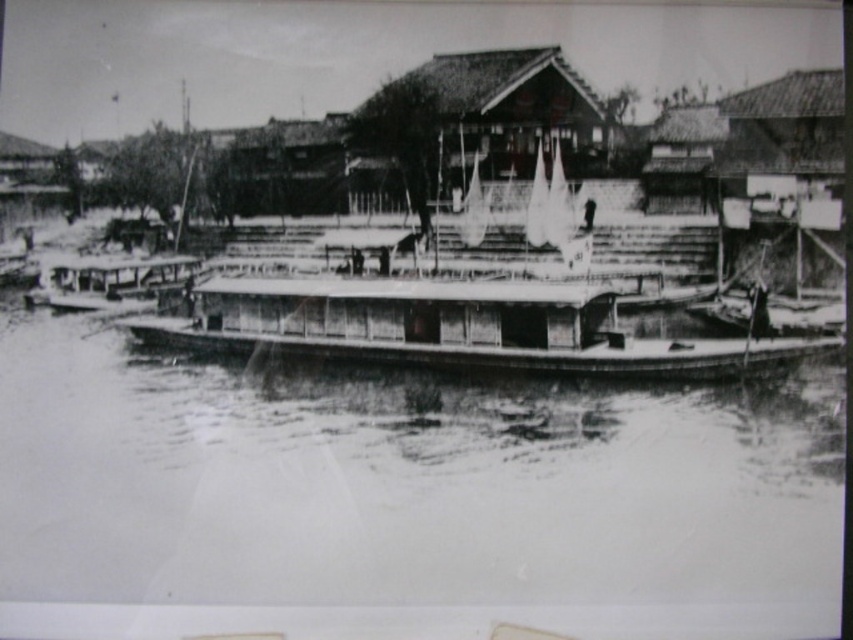
Does smooth wooden boat at center have a larger size compared to wooden boat at center?

Actually, smooth wooden boat at center might be smaller than wooden boat at center.

Does smooth wooden boat at center have a greater height compared to wooden boat at center?

Correct, smooth wooden boat at center is much taller as wooden boat at center.

What do you see at coordinates (398, 483) in the screenshot?
I see `smooth wooden boat at center` at bounding box center [398, 483].

Identify the location of smooth wooden boat at center. The width and height of the screenshot is (853, 640). (398, 483).